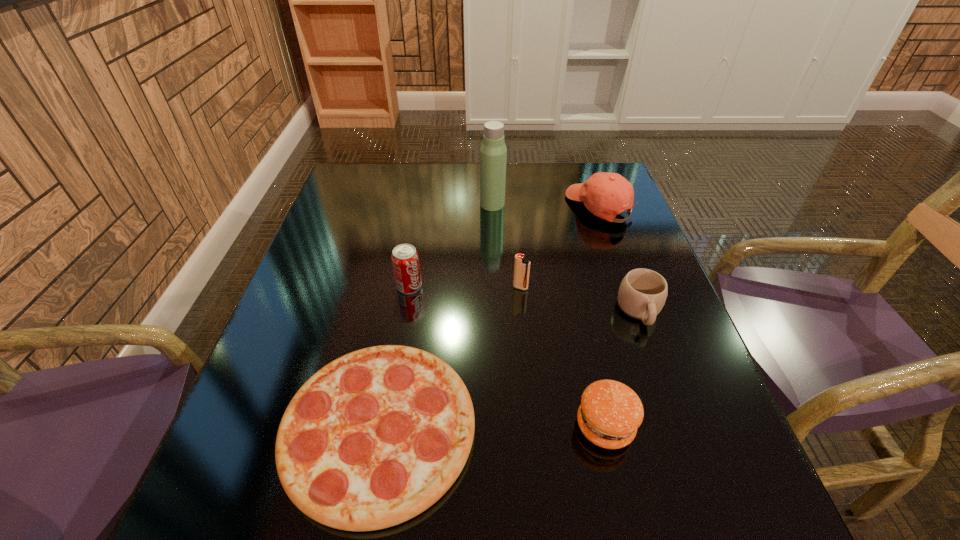
Locate an element on the screen. Image resolution: width=960 pixels, height=540 pixels. free space that is in between the shortest object and the fourth object from right to left is located at coordinates (450, 358).

Where is `vacant area that lies between the mug and the baseball cap`? The width and height of the screenshot is (960, 540). vacant area that lies between the mug and the baseball cap is located at coordinates (620, 259).

Locate an element on the screen. The image size is (960, 540). empty location between the thermos bottle and the soda can is located at coordinates (451, 245).

You are a GUI agent. You are given a task and a screenshot of the screen. Output one action in this format:
    pyautogui.click(x=<x>, y=<y>)
    Task: Click on the free spot between the mug and the fifth object from right to left
    
    Given the screenshot: What is the action you would take?
    pyautogui.click(x=566, y=258)

This screenshot has width=960, height=540. Find the location of `free space between the mug and the baseball cap`. free space between the mug and the baseball cap is located at coordinates (620, 259).

Identify the location of unoccupied position between the patty and the baseball cap. (603, 316).

The width and height of the screenshot is (960, 540). In order to click on vacant area between the patty and the mug in this screenshot , I will do `click(622, 368)`.

Locate an element on the screen. free spot between the patty and the soda can is located at coordinates (507, 356).

Image resolution: width=960 pixels, height=540 pixels. Find the location of `vacant area between the fourth object from left to right and the baseball cap`. vacant area between the fourth object from left to right and the baseball cap is located at coordinates (561, 247).

What are the coordinates of `object that ranks as the third closest to the thermos bottle` in the screenshot? It's located at (405, 260).